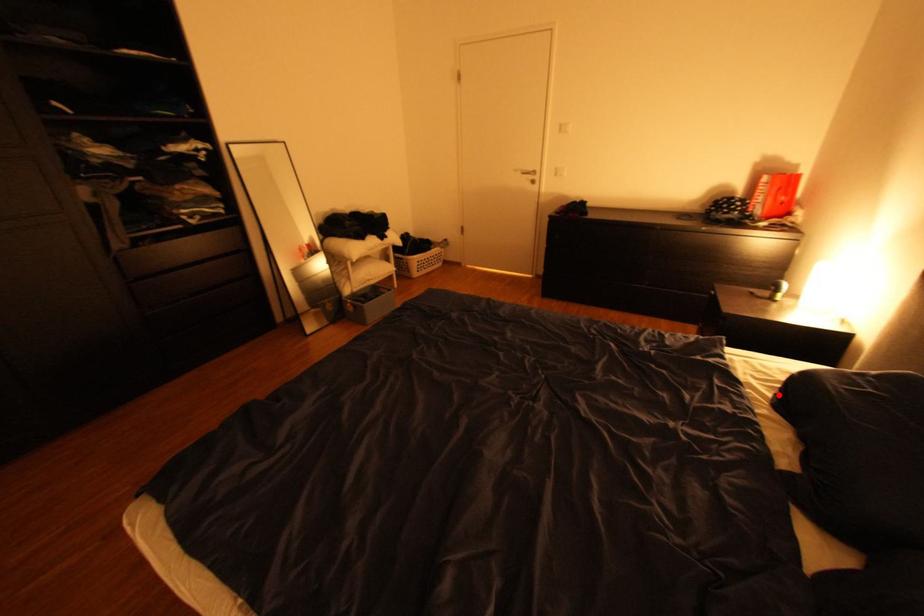
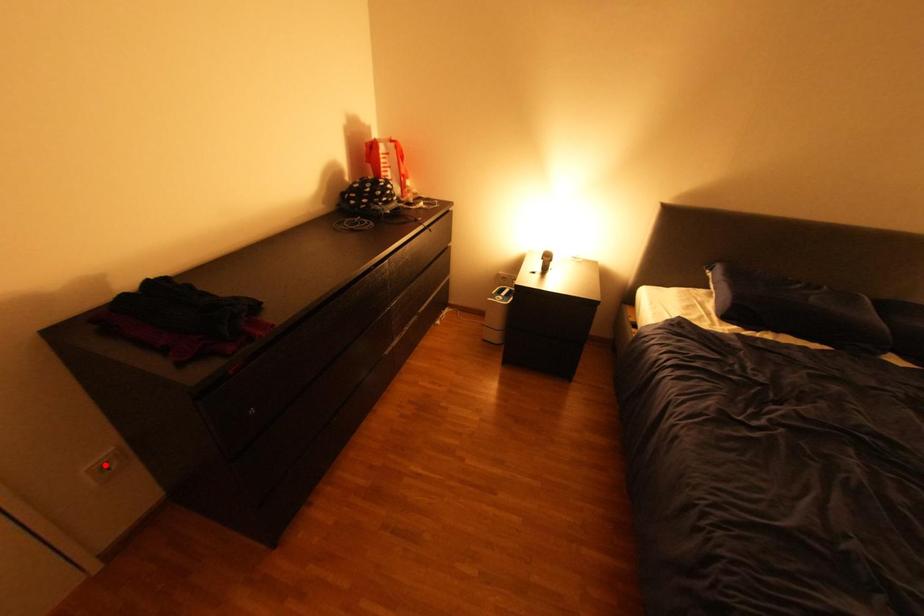
I am providing you with two images of the same scene from different viewpoints. A red point is marked on the first image and another point is marked on the second image. Is the red point in image1 aligned with the point shown in image2?

No